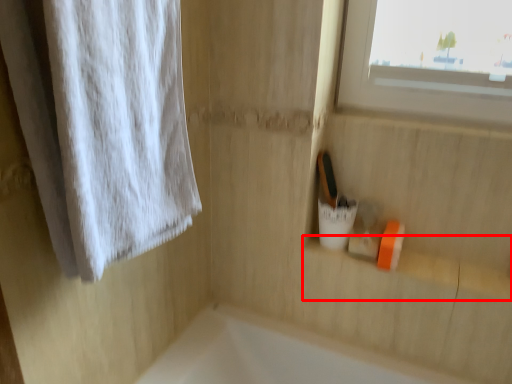
Question: From the image's perspective, where is window sill (annotated by the red box) located in relation to curtain in the image?

Choices:
 (A) below
 (B) above

Answer: (A)